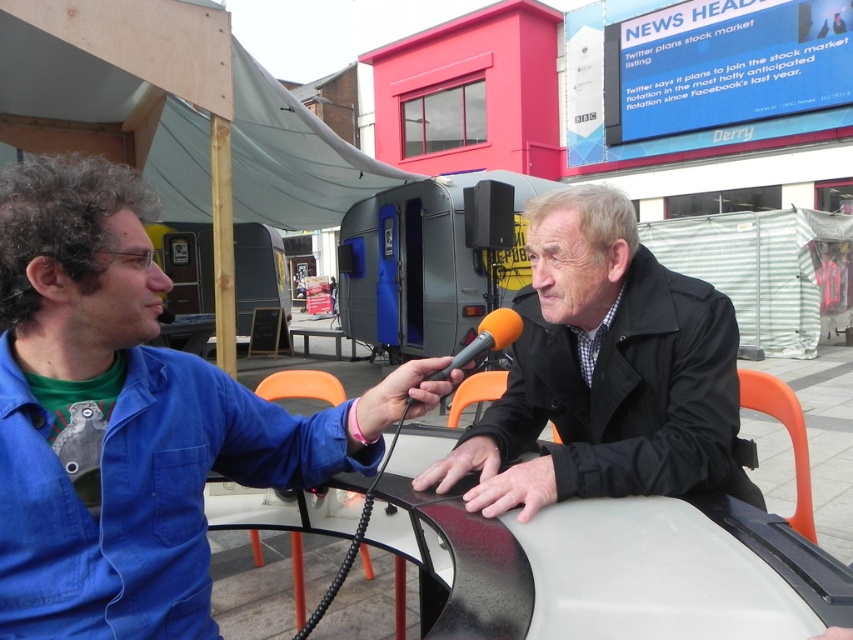
Is blue cotton shirt at left to the right of black matte jacket at center from the viewer's perspective?

Incorrect, blue cotton shirt at left is not on the right side of black matte jacket at center.

From the picture: Does blue cotton shirt at left have a smaller size compared to black matte jacket at center?

Indeed, blue cotton shirt at left has a smaller size compared to black matte jacket at center.

Is point (154, 435) closer to viewer compared to point (614, 497)?

Yes, point (154, 435) is in front of point (614, 497).

Find the location of `blue cotton shirt at left`. blue cotton shirt at left is located at coordinates (131, 419).

Is point (119, 598) farther from camera compared to point (457, 364)?

No, it is in front of (457, 364).

Based on the photo, is blue cotton shirt at left thinner than orange matte microphone at center?

No, blue cotton shirt at left is not thinner than orange matte microphone at center.

Is point (71, 182) positioned behind point (515, 321)?

No, it is in front of (515, 321).

Locate an element on the screen. The width and height of the screenshot is (853, 640). blue cotton shirt at left is located at coordinates (131, 419).

Is black matte jacket at center positioned before orange matte microphone at center?

Yes, black matte jacket at center is in front of orange matte microphone at center.

Is black matte jacket at center wider than orange matte microphone at center?

Yes, black matte jacket at center is wider than orange matte microphone at center.

This screenshot has height=640, width=853. What do you see at coordinates (605, 372) in the screenshot?
I see `black matte jacket at center` at bounding box center [605, 372].

Where is `black matte jacket at center`? This screenshot has height=640, width=853. black matte jacket at center is located at coordinates pos(605,372).